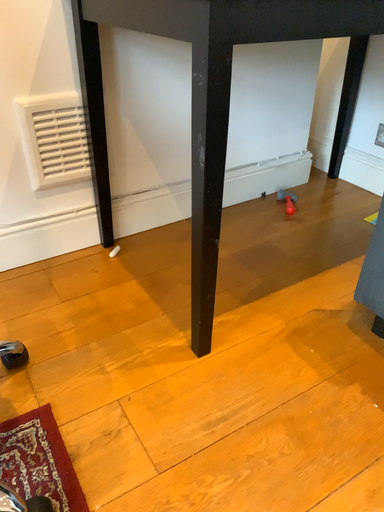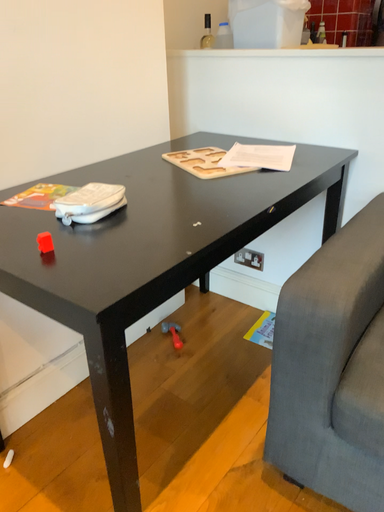
Question: Which way did the camera rotate in the video?

Choices:
 (A) rotated left
 (B) rotated right

Answer: (B)